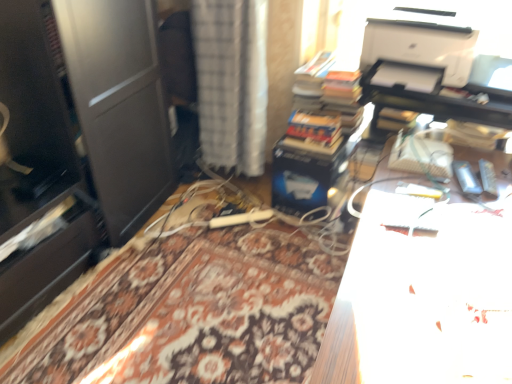
Question: Considering the positions of white glossy paper at upper right and white textured curtain at center in the image, is white glossy paper at upper right wider or thinner than white textured curtain at center?

Choices:
 (A) wide
 (B) thin

Answer: (A)

Question: Visually, is white glossy paper at upper right positioned to the left or to the right of white textured curtain at center?

Choices:
 (A) left
 (B) right

Answer: (B)

Question: Based on their relative distances, which object is farther from the hardcover books at center?

Choices:
 (A) white textured curtain at center
 (B) white matte printer at upper right
 (C) white glossy paper at upper right

Answer: (C)

Question: Which is nearer to the white matte printer at upper right?

Choices:
 (A) white textured curtain at center
 (B) white glossy paper at upper right
 (C) hardcover books at center

Answer: (C)